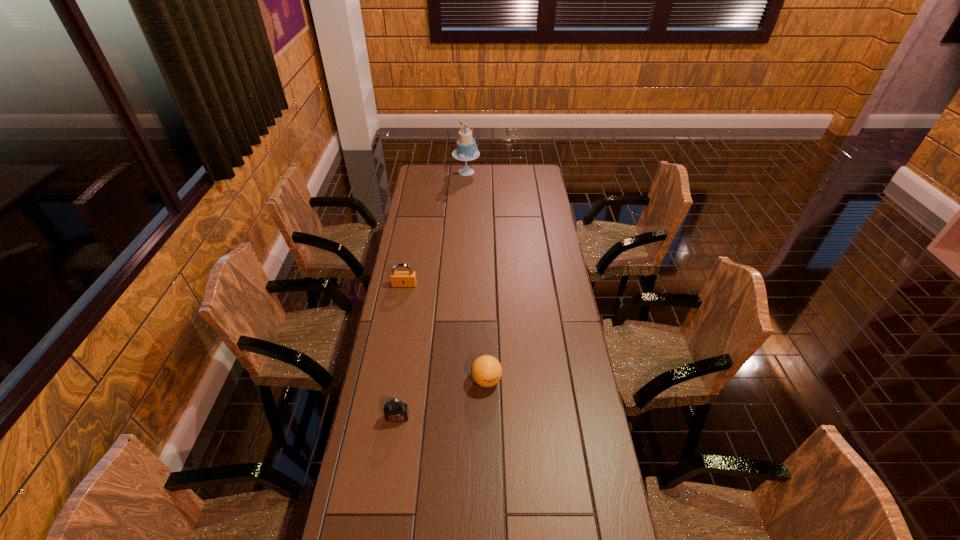
This screenshot has width=960, height=540. What are the coordinates of `object that stands as the closest to the farther padlock` in the screenshot? It's located at (486, 371).

Point out which object is positioned as the nearest to the farthest object. Please provide its 2D coordinates. Your answer should be formatted as a tuple, i.e. [(x, y)], where the tuple contains the x and y coordinates of a point satisfying the conditions above.

[(398, 278)]

I want to click on free point that satisfies the following two spatial constraints: 1. with a ladder on the side of the farthest object; 2. on the front of the nearer padlock near the keyhole, so click(x=455, y=417).

Find the location of a particular element. This screenshot has height=540, width=960. free space that satisfies the following two spatial constraints: 1. with a ladder on the side of the tallest object; 2. to unlock the second farthest object from the front is located at coordinates (462, 285).